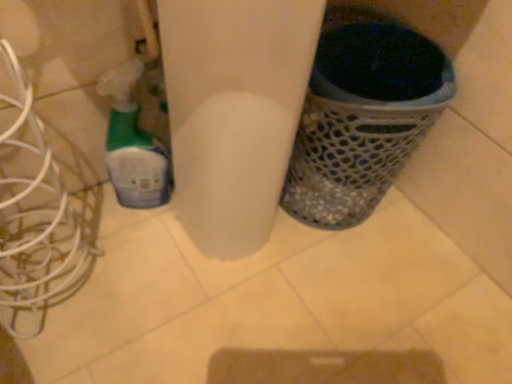
Question: Is point (12, 175) closer or farther from the camera than point (366, 180)?

Choices:
 (A) farther
 (B) closer

Answer: (A)

Question: From their relative heights in the image, would you say white metallic wires at left is taller or shorter than metallic mesh waste bin at right?

Choices:
 (A) tall
 (B) short

Answer: (A)

Question: Which is nearer to the translucent plastic spray bottle at left?

Choices:
 (A) white metallic wires at left
 (B) metallic mesh waste bin at right

Answer: (A)

Question: Which object is positioned farthest from the metallic mesh waste bin at right?

Choices:
 (A) white metallic wires at left
 (B) translucent plastic spray bottle at left

Answer: (A)